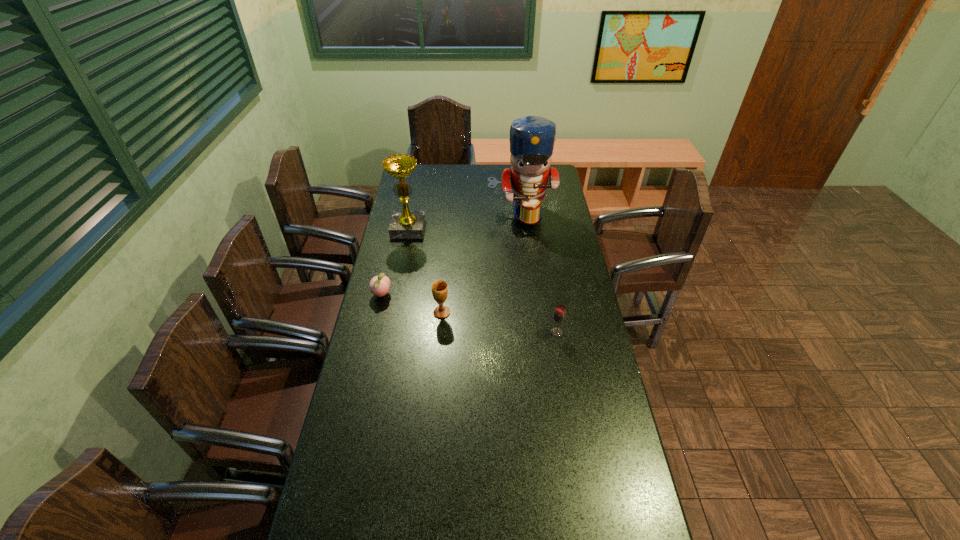
Find the location of `vacant area that satisfies the following two spatial constraints: 1. on the front-facing side of the nutcracker; 2. on the right side of the glass drink container`. vacant area that satisfies the following two spatial constraints: 1. on the front-facing side of the nutcracker; 2. on the right side of the glass drink container is located at coordinates (535, 333).